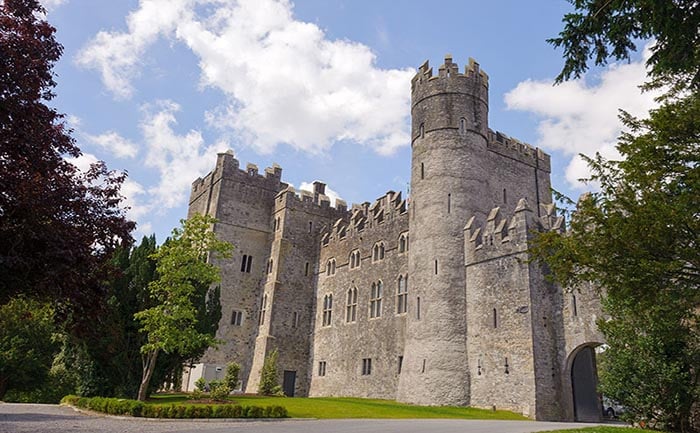
Find the location of `door`. door is located at coordinates (290, 383).